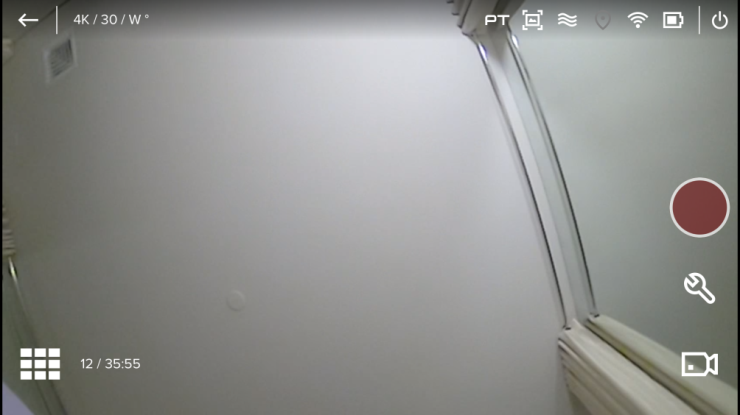
Where is `mirror`? mirror is located at coordinates (605, 228).